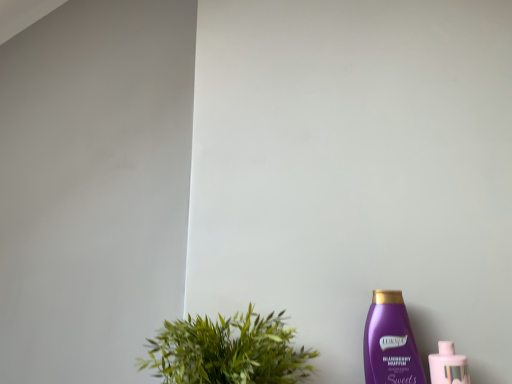
Question: Is green leafy plant at lower left facing towards purple plastic bottle at lower right, marked as the second bottle in a right-to-left arrangement?

Choices:
 (A) yes
 (B) no

Answer: (B)

Question: Does green leafy plant at lower left have a larger size compared to purple plastic bottle at lower right, the first bottle in the left-to-right sequence?

Choices:
 (A) no
 (B) yes

Answer: (B)

Question: Is green leafy plant at lower left taller than purple plastic bottle at lower right, the first bottle in the left-to-right sequence?

Choices:
 (A) yes
 (B) no

Answer: (B)

Question: From a real-world perspective, is green leafy plant at lower left on purple plastic bottle at lower right, marked as the second bottle in a right-to-left arrangement?

Choices:
 (A) no
 (B) yes

Answer: (B)

Question: Is green leafy plant at lower left positioned beyond the bounds of purple plastic bottle at lower right, the first bottle in the left-to-right sequence?

Choices:
 (A) no
 (B) yes

Answer: (B)

Question: Is green leafy plant at lower left in front of purple plastic bottle at lower right, the first bottle in the left-to-right sequence?

Choices:
 (A) yes
 (B) no

Answer: (A)

Question: From a real-world perspective, is green leafy plant at lower left beneath pink glossy bottle at lower right, which is the second bottle from left to right?

Choices:
 (A) no
 (B) yes

Answer: (A)

Question: Is green leafy plant at lower left closer to camera compared to pink glossy bottle at lower right, arranged as the first bottle when viewed from the right?

Choices:
 (A) no
 (B) yes

Answer: (B)

Question: Is pink glossy bottle at lower right, which is the second bottle from left to right, inside green leafy plant at lower left?

Choices:
 (A) yes
 (B) no

Answer: (B)

Question: Is green leafy plant at lower left looking in the opposite direction of pink glossy bottle at lower right, which is the second bottle from left to right?

Choices:
 (A) no
 (B) yes

Answer: (A)

Question: Can you confirm if green leafy plant at lower left is positioned to the right of pink glossy bottle at lower right, which is the second bottle from left to right?

Choices:
 (A) no
 (B) yes

Answer: (A)

Question: From the image's perspective, does green leafy plant at lower left appear lower than pink glossy bottle at lower right, arranged as the first bottle when viewed from the right?

Choices:
 (A) yes
 (B) no

Answer: (B)

Question: Is pink glossy bottle at lower right, arranged as the first bottle when viewed from the right, smaller than green leafy plant at lower left?

Choices:
 (A) no
 (B) yes

Answer: (B)